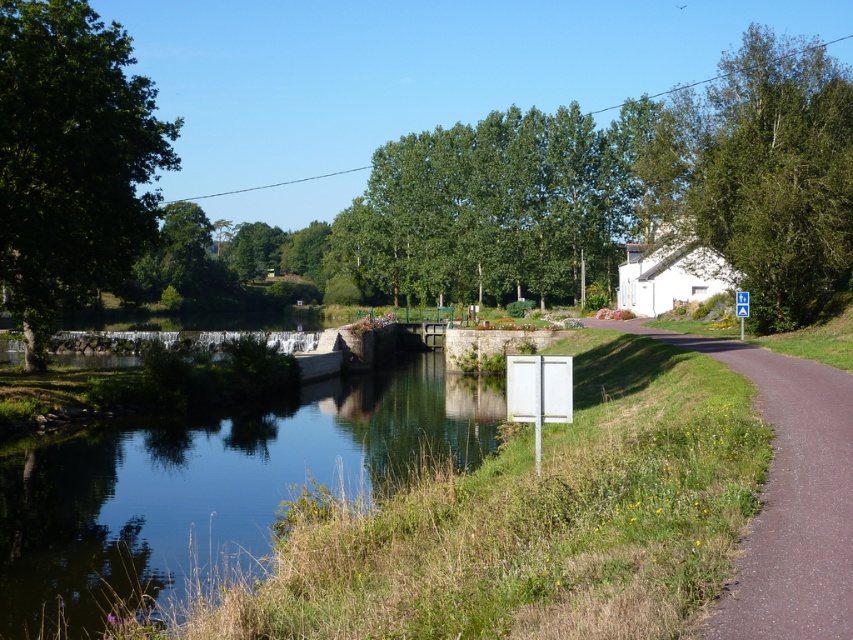
Question: Which object is positioned farthest from the clear water at center?

Choices:
 (A) white plastic sign at center
 (B) green leafy tree at upper right
 (C) green leafy tree at left
 (D) green leafy tree at center

Answer: (D)

Question: Which object appears farthest from the camera in this image?

Choices:
 (A) green leafy tree at left
 (B) brown asphalt path at lower right
 (C) white plastic sign at center

Answer: (C)

Question: Considering the real-world distances, which object is farthest from the green leafy tree at upper right?

Choices:
 (A) green leafy tree at center
 (B) clear water at center
 (C) white plastic sign at center
 (D) brown asphalt path at lower right

Answer: (C)

Question: Can you confirm if green leafy tree at center is positioned to the right of green leafy tree at upper right?

Choices:
 (A) no
 (B) yes

Answer: (A)

Question: Does green leafy tree at left have a larger size compared to green leafy tree at upper right?

Choices:
 (A) no
 (B) yes

Answer: (A)

Question: Does green leafy tree at upper right appear on the left side of white plastic sign at center?

Choices:
 (A) no
 (B) yes

Answer: (A)